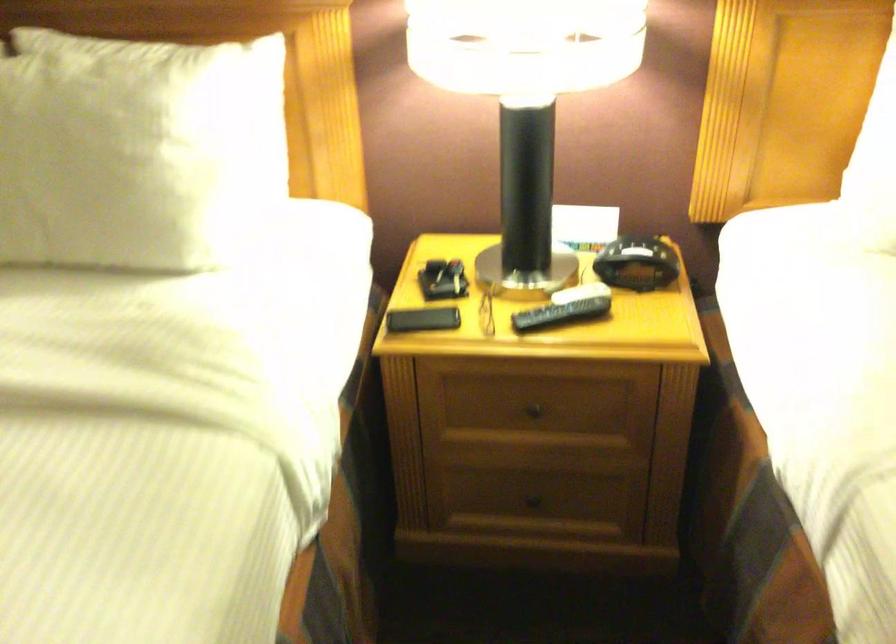
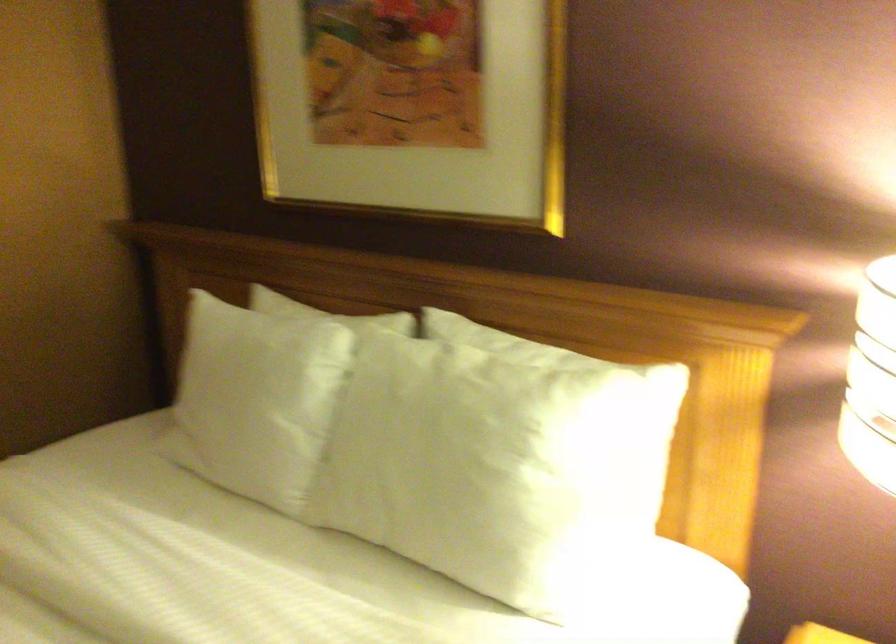
Question: How did the camera likely rotate?

Choices:
 (A) Left
 (B) Right
 (C) Up
 (D) Down

Answer: (A)